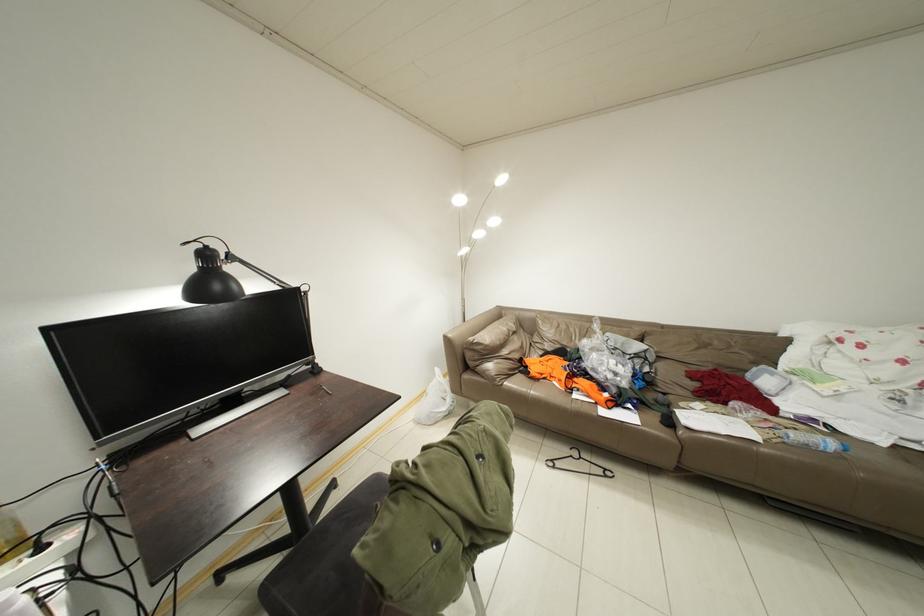
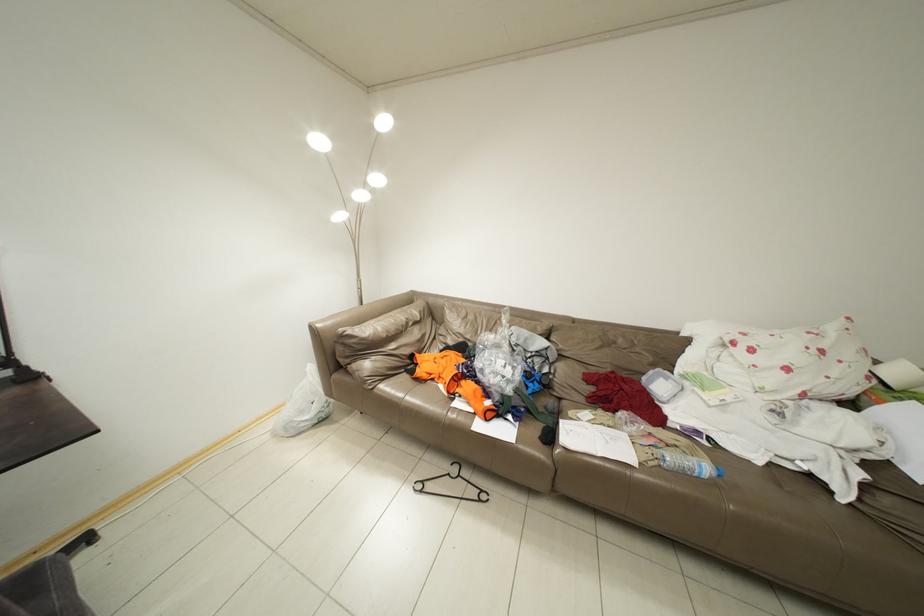
Which direction would the cameraman need to move to produce the second image?

The cameraman walked toward right, forward.